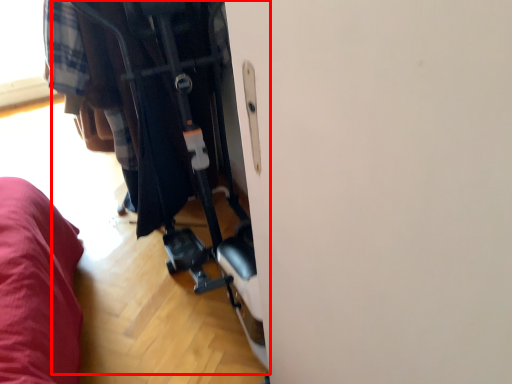
Question: In this image, where is baby carriage (annotated by the red box) located relative to clothing?

Choices:
 (A) right
 (B) left

Answer: (A)